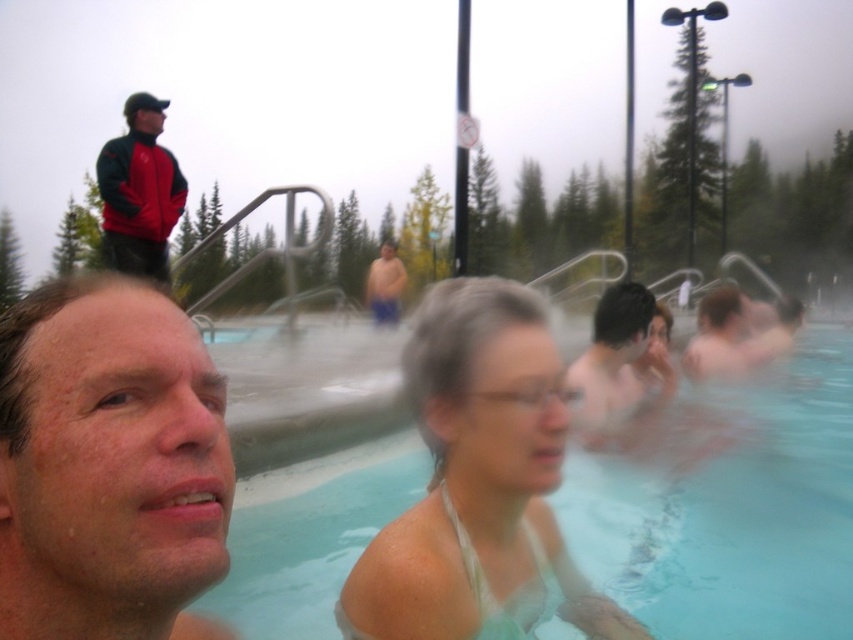
Who is taller, clear plastic water at center or red fleece jacket at upper left?

red fleece jacket at upper left

Is point (850, 582) more distant than point (148, 188)?

No, it is not.

Image resolution: width=853 pixels, height=640 pixels. Find the location of `clear plastic water at center`. clear plastic water at center is located at coordinates (730, 506).

Where is `clear plastic water at center`? This screenshot has width=853, height=640. clear plastic water at center is located at coordinates [x=730, y=506].

Describe the element at coordinates (479, 483) in the screenshot. I see `white fabric at center` at that location.

Locate an element on the screen. The image size is (853, 640). white fabric at center is located at coordinates (479, 483).

You are a GUI agent. You are given a task and a screenshot of the screen. Output one action in this format:
    pyautogui.click(x=<x>, y=<y>)
    Task: Click on the white fabric at center
    
    Given the screenshot: What is the action you would take?
    pyautogui.click(x=479, y=483)

Is dry skin face at center above blue fabric shorts at center?

No, dry skin face at center is not above blue fabric shorts at center.

Is point (73, 580) positioned behind point (370, 275)?

No.

Identify the location of dry skin face at center. This screenshot has width=853, height=640. (108, 465).